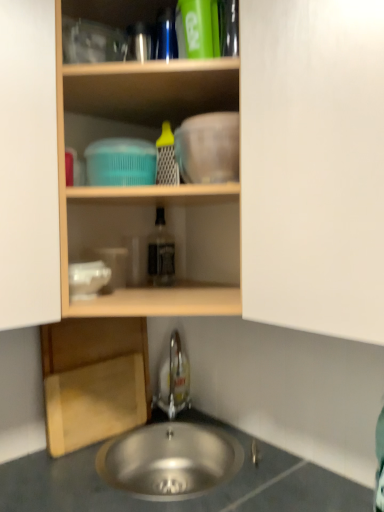
Question: Is white matte cabinet at center at the back of wooden shelf at upper center?

Choices:
 (A) no
 (B) yes

Answer: (A)

Question: Is wooden shelf at upper center in front of white matte cabinet at center?

Choices:
 (A) no
 (B) yes

Answer: (A)

Question: From a real-world perspective, is wooden shelf at upper center on white matte cabinet at center?

Choices:
 (A) no
 (B) yes

Answer: (B)

Question: Would you consider wooden shelf at upper center to be distant from white matte cabinet at center?

Choices:
 (A) no
 (B) yes

Answer: (A)

Question: Is wooden shelf at upper center taller than white matte cabinet at center?

Choices:
 (A) yes
 (B) no

Answer: (A)

Question: Is translucent glass bottle at center spatially inside white matte cabinet at center, or outside of it?

Choices:
 (A) outside
 (B) inside

Answer: (A)

Question: From the image's perspective, is translucent glass bottle at center above or below white matte cabinet at center?

Choices:
 (A) below
 (B) above

Answer: (A)

Question: Looking at the image, does translucent glass bottle at center seem bigger or smaller compared to white matte cabinet at center?

Choices:
 (A) small
 (B) big

Answer: (A)

Question: Considering the relative positions of translucent glass bottle at center and white matte cabinet at center in the image provided, is translucent glass bottle at center to the left or to the right of white matte cabinet at center?

Choices:
 (A) right
 (B) left

Answer: (B)

Question: Considering the positions of point (301, 470) and point (236, 465), is point (301, 470) closer or farther from the camera than point (236, 465)?

Choices:
 (A) farther
 (B) closer

Answer: (B)

Question: Relative to stainless steel sink at lower center, is metallic gray sink at lower center in front or behind?

Choices:
 (A) behind
 (B) front

Answer: (B)

Question: Considering the positions of metallic gray sink at lower center and stainless steel sink at lower center in the image, is metallic gray sink at lower center taller or shorter than stainless steel sink at lower center?

Choices:
 (A) tall
 (B) short

Answer: (A)

Question: Is metallic gray sink at lower center bigger or smaller than stainless steel sink at lower center?

Choices:
 (A) small
 (B) big

Answer: (B)

Question: In terms of width, does stainless steel sink at lower center look wider or thinner when compared to wooden shelf at upper center?

Choices:
 (A) thin
 (B) wide

Answer: (A)

Question: Is stainless steel sink at lower center situated inside wooden shelf at upper center or outside?

Choices:
 (A) outside
 (B) inside

Answer: (A)